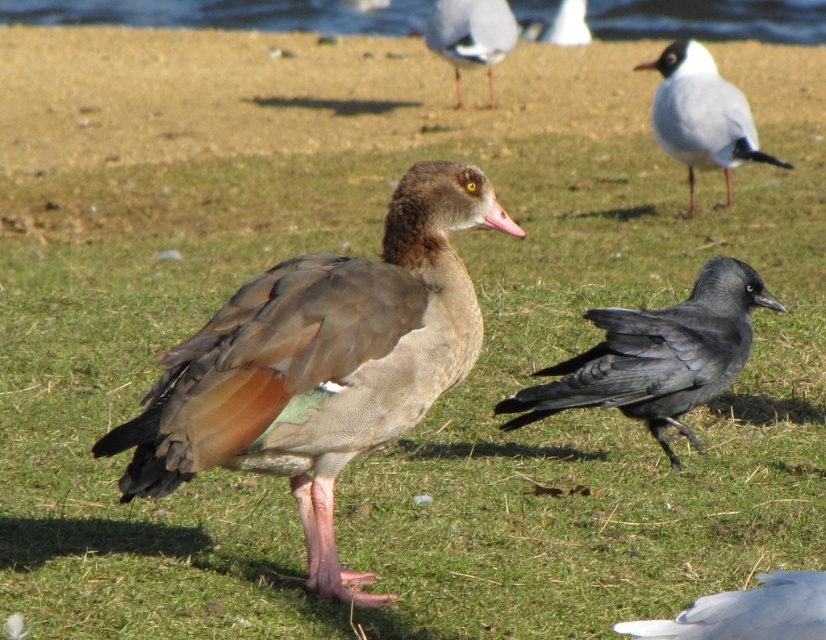
Does shiny black crow at right have a lesser width compared to white glossy seagull at upper right?

A: No.

Is shiny black crow at right positioned at the back of white glossy seagull at upper right?

That is False.

Identify the location of shiny black crow at right. [656, 356].

Locate an element on the screen. This screenshot has width=826, height=640. shiny black crow at right is located at coordinates (656, 356).

Between point (190, 8) and point (506, 221), which one is positioned in front?

Positioned in front is point (506, 221).

Who is taller, clear water at upper center or pink matte beak at center?

Standing taller between the two is clear water at upper center.

Locate an element on the screen. The width and height of the screenshot is (826, 640). clear water at upper center is located at coordinates (228, 13).

Is point (131, 468) farther from camera compared to point (482, 20)?

No, (131, 468) is closer to viewer.

Describe the element at coordinates (319, 365) in the screenshot. The width and height of the screenshot is (826, 640). I see `brown feathered duck at center` at that location.

Between point (127, 497) and point (492, 90), which one is positioned in front?

Point (127, 497) is in front.

The width and height of the screenshot is (826, 640). In order to click on brown feathered duck at center in this screenshot , I will do `click(319, 365)`.